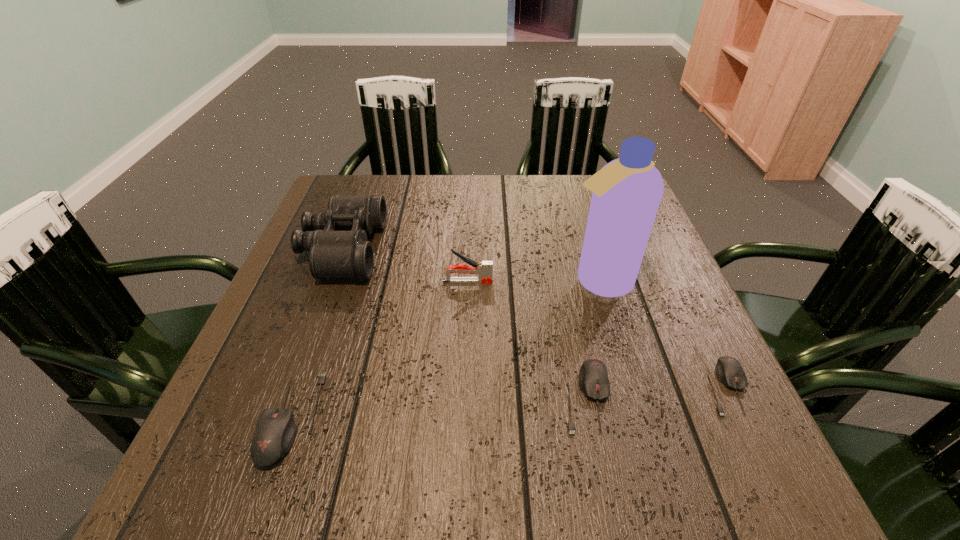
Where is `the leftmost mouse`? This screenshot has height=540, width=960. the leftmost mouse is located at coordinates tap(275, 432).

Locate an element on the screen. This screenshot has height=540, width=960. the second mouse from right to left is located at coordinates (593, 379).

Find the location of a particular element. the second tallest mouse is located at coordinates (593, 379).

Identify the location of the shortest object. Image resolution: width=960 pixels, height=540 pixels. (729, 371).

Identify the location of the rightmost mouse. (729, 371).

I want to click on stapler, so click(x=484, y=269).

The height and width of the screenshot is (540, 960). In order to click on the third tallest object in this screenshot , I will do `click(484, 269)`.

Image resolution: width=960 pixels, height=540 pixels. What are the coordinates of `binoculars` in the screenshot? It's located at (337, 240).

Find the location of a particular element. the tallest object is located at coordinates (627, 191).

Find the location of `free region located 0.070m on the right of the leftmost mouse`. free region located 0.070m on the right of the leftmost mouse is located at coordinates (357, 418).